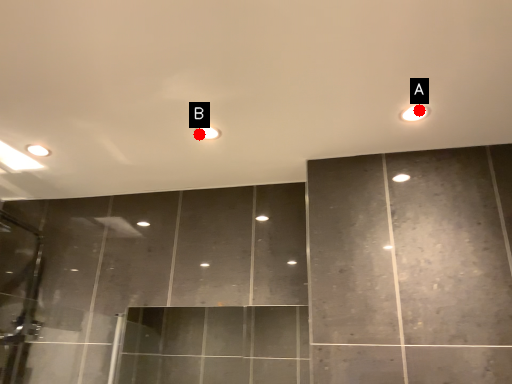
Question: Two points are circled on the image, labeled by A and B beside each circle. Which point is further to the camera?

Choices:
 (A) A is further
 (B) B is further

Answer: (B)